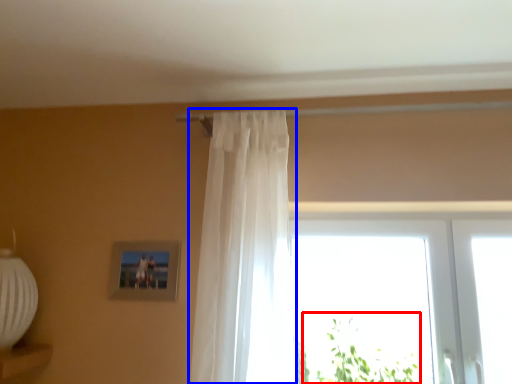
Question: Which of the following is the closest to the observer, plant (highlighted by a red box) or curtain (highlighted by a blue box)?

Choices:
 (A) plant
 (B) curtain

Answer: (B)